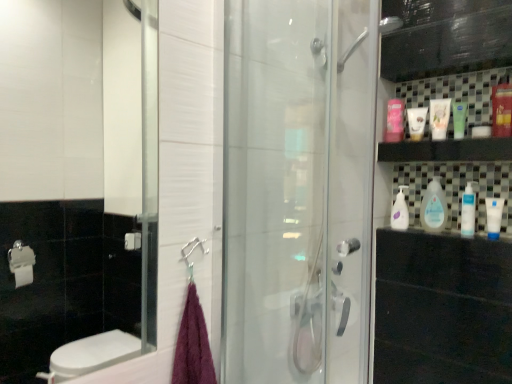
Question: From a real-world perspective, is white matte tube at upper right, the 2th mouthwash in the left-to-right sequence, above or below blue matte tube at right, acting as the second mouthwash starting from the right?

Choices:
 (A) below
 (B) above

Answer: (B)

Question: Is white matte tube at upper right, the 5th mouthwash when ordered from right to left, in front of or behind blue matte tube at right, acting as the second mouthwash starting from the right, in the image?

Choices:
 (A) front
 (B) behind

Answer: (B)

Question: Considering the real-world distances, which object is closest to the pink glossy mouthwash at upper right, marked as the 1th mouthwash in a left-to-right arrangement?

Choices:
 (A) white glossy bottle at right, the first cleaning product from the right
 (B) purple fluffy towel at lower left
 (C) clear plastic bottle at center, marked as the 2th cleaning product in a back-to-front arrangement
 (D) white glossy tube at upper right, arranged as the third mouthwash when viewed from the left
 (E) blue matte tube at right, acting as the second mouthwash starting from the right

Answer: (D)

Question: Which is nearer to the blue matte tube at right, positioned as the fifth mouthwash in left-to-right order?

Choices:
 (A) white glossy tube at upper right, arranged as the third mouthwash when viewed from the left
 (B) green matte tube at upper right, arranged as the 4th mouthwash when viewed from the left
 (C) purple fluffy towel at lower left
 (D) red plastic mouthwash at upper right, which is counted as the 6th mouthwash, starting from the left
 (E) transparent glass shower door at center

Answer: (B)